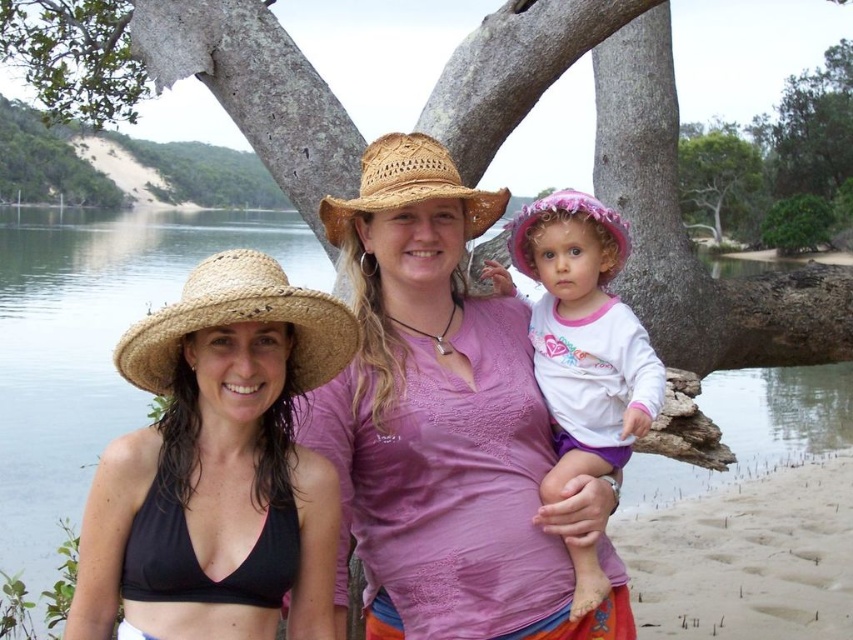
Looking at this image, you are a photographer trying to capture the scene with the two women and the child. You notice the matte straw hat at center and the green leafy tree at upper center. Which object is positioned to the left of the other?

The matte straw hat at center is to the left of the green leafy tree at upper center.